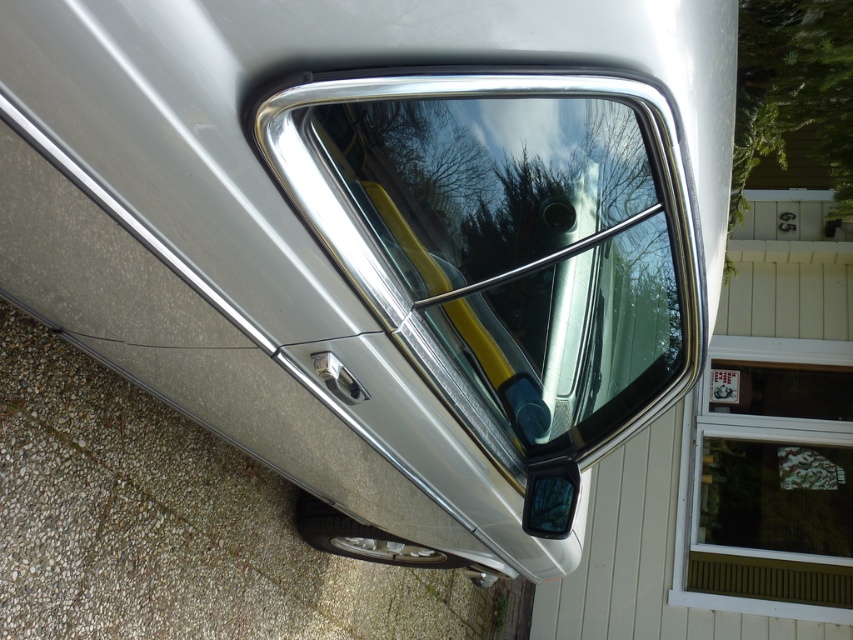
Question: Considering the real-world distances, which object is farthest from the glossy plastic mirror at lower right?

Choices:
 (A) polished chrome window at center
 (B) white plastic window at upper right

Answer: (B)

Question: Which object is the closest to the polished chrome window at center?

Choices:
 (A) glossy plastic mirror at lower right
 (B) white plastic window at upper right

Answer: (A)

Question: Which of these objects is positioned farthest from the polished chrome window at center?

Choices:
 (A) white plastic window at upper right
 (B) glossy plastic mirror at lower right

Answer: (A)

Question: Is polished chrome window at center wider than glossy plastic mirror at lower right?

Choices:
 (A) no
 (B) yes

Answer: (B)

Question: Can you confirm if white plastic window at upper right is wider than glossy plastic mirror at lower right?

Choices:
 (A) no
 (B) yes

Answer: (B)

Question: Is polished chrome window at center positioned before white plastic window at upper right?

Choices:
 (A) no
 (B) yes

Answer: (B)